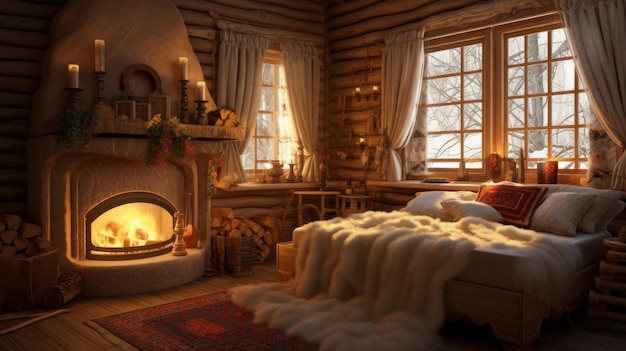
This screenshot has height=351, width=626. Identify the location of curtains. (233, 68), (308, 81), (394, 66), (602, 55).